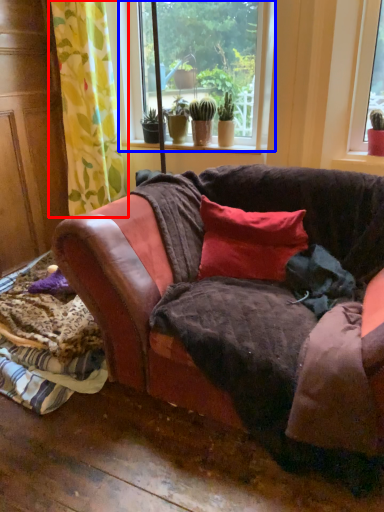
Question: Which of the following is the closest to the observer, curtain (highlighted by a red box) or window (highlighted by a blue box)?

Choices:
 (A) curtain
 (B) window

Answer: (A)